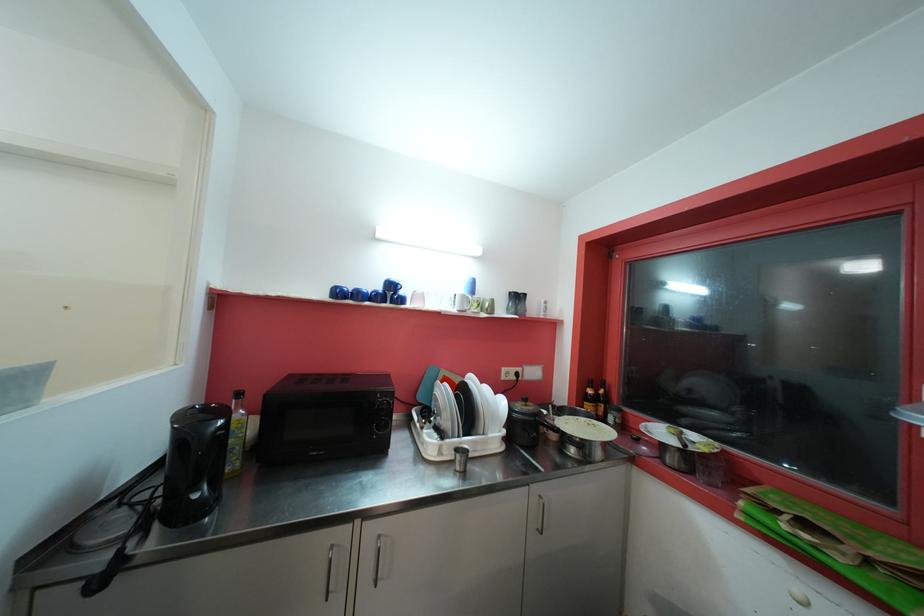
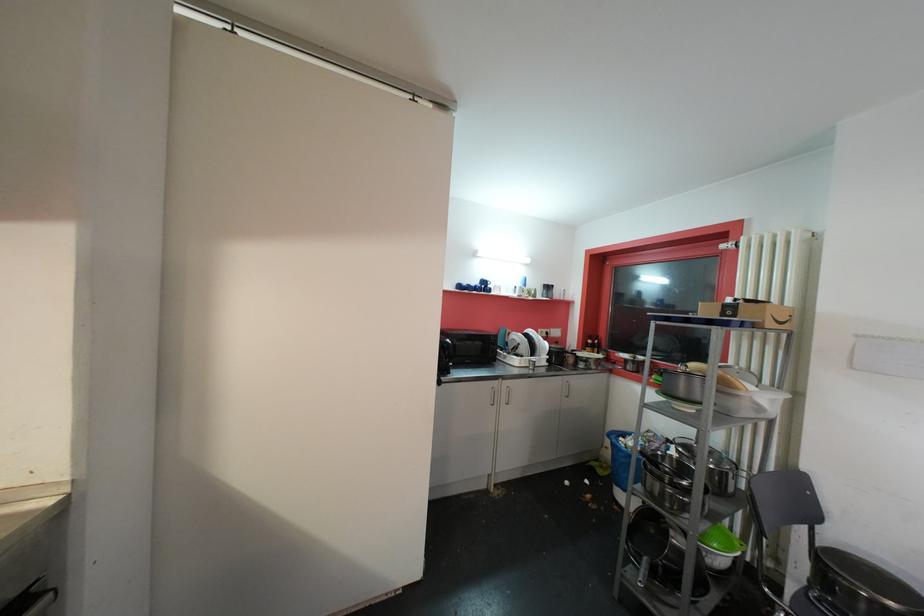
Where in the second image is the point corresponding to [497,304] from the first image?

(541, 293)